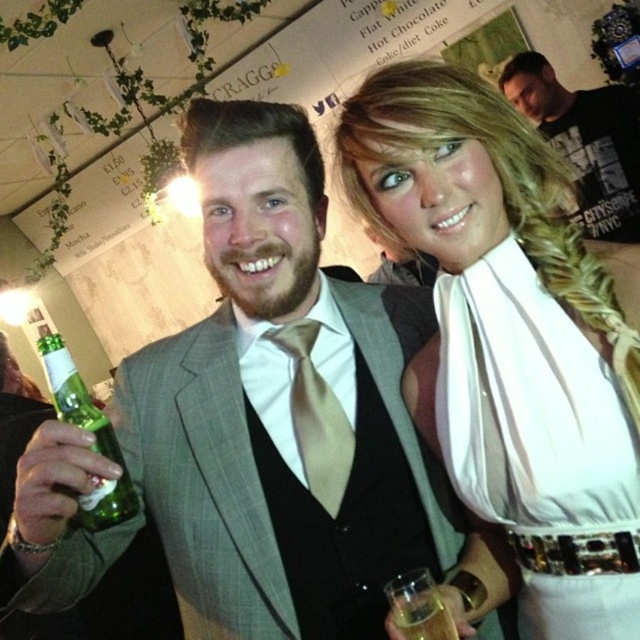
Can you confirm if white satin dress at center is positioned below translucent glass at lower center?

No, white satin dress at center is not below translucent glass at lower center.

Can you confirm if white satin dress at center is thinner than translucent glass at lower center?

No.

Is point (465, 134) closer to viewer compared to point (410, 595)?

No, (465, 134) is further to viewer.

Find the location of a particular element. The height and width of the screenshot is (640, 640). white satin dress at center is located at coordinates (513, 337).

Between black cotton t-shirt at upper right and gray textured suit at center, which one appears on the right side from the viewer's perspective?

Positioned to the right is black cotton t-shirt at upper right.

Is point (588, 182) more distant than point (413, 305)?

Yes, it is.

The height and width of the screenshot is (640, 640). In order to click on black cotton t-shirt at upper right in this screenshot , I will do `click(586, 141)`.

Can you confirm if gray textured suit at center is positioned to the left of satin beige tie at center?

Correct, you'll find gray textured suit at center to the left of satin beige tie at center.

Based on the photo, is the position of gray textured suit at center less distant than that of satin beige tie at center?

Yes.

Describe the element at coordinates (134, 593) in the screenshot. Image resolution: width=640 pixels, height=640 pixels. I see `gray textured suit at center` at that location.

Where is `gray textured suit at center`? gray textured suit at center is located at coordinates (134, 593).